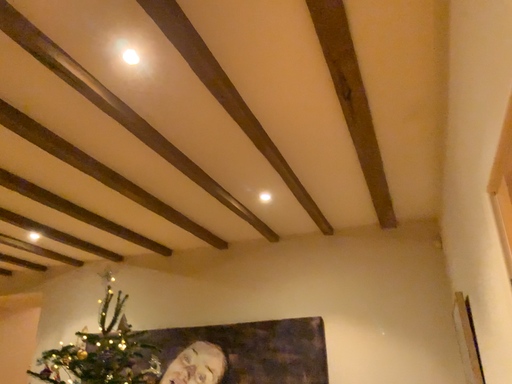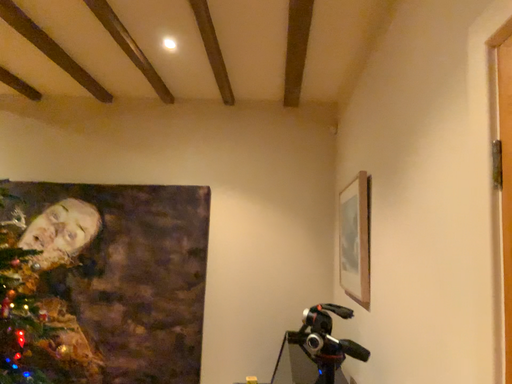
Question: Which way did the camera rotate in the video?

Choices:
 (A) rotated downward
 (B) rotated upward

Answer: (A)